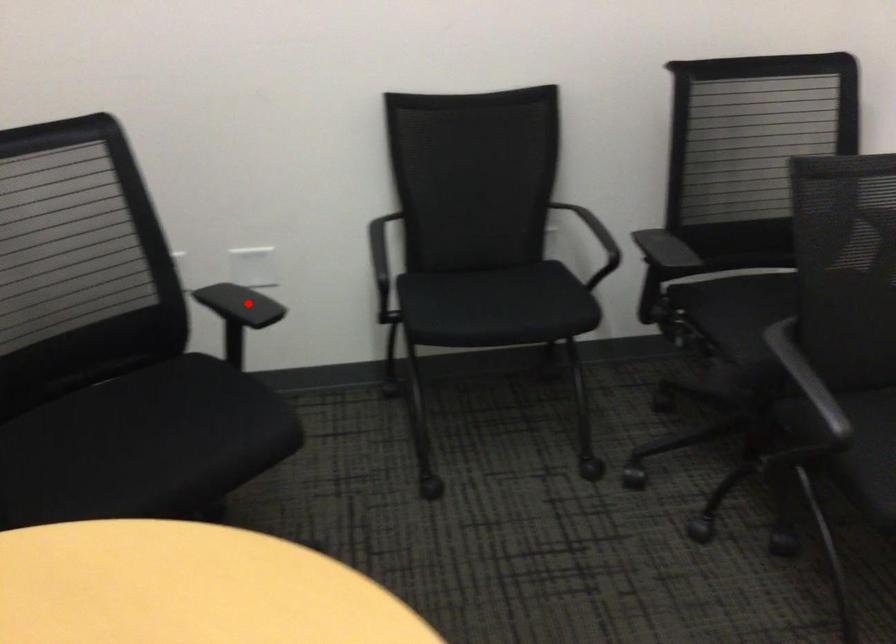
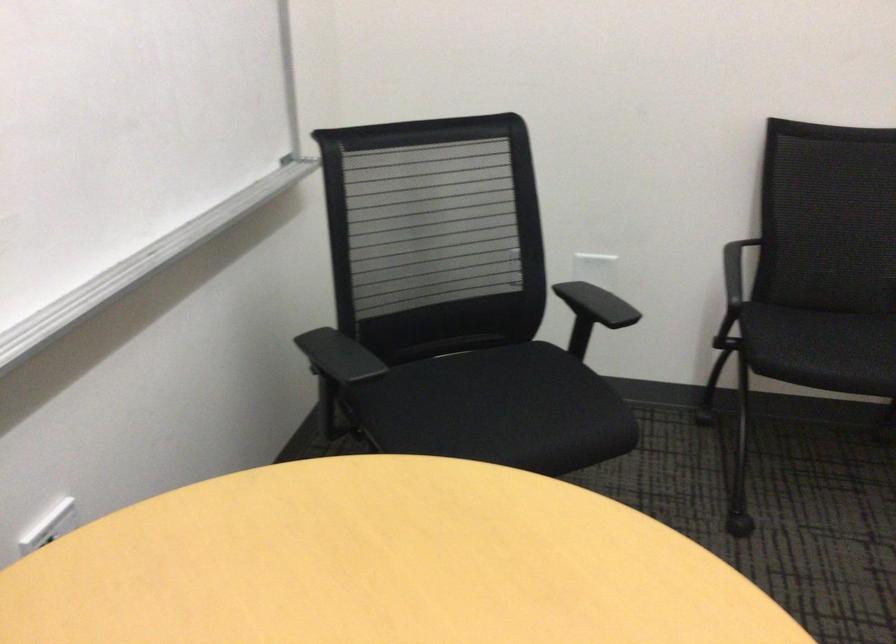
Where in the second image is the point corresponding to the highlighted location from the first image?

(597, 304)